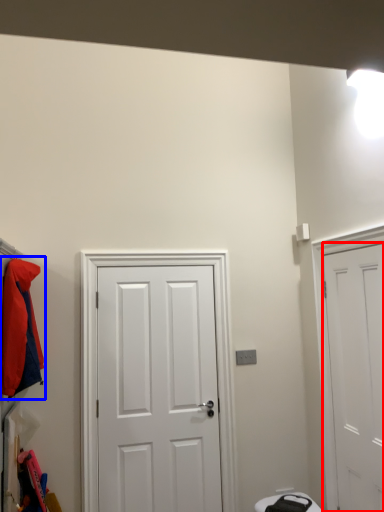
Question: Which object appears closest to the camera in this image, door (highlighted by a red box) or jacket (highlighted by a blue box)?

Choices:
 (A) door
 (B) jacket

Answer: (A)